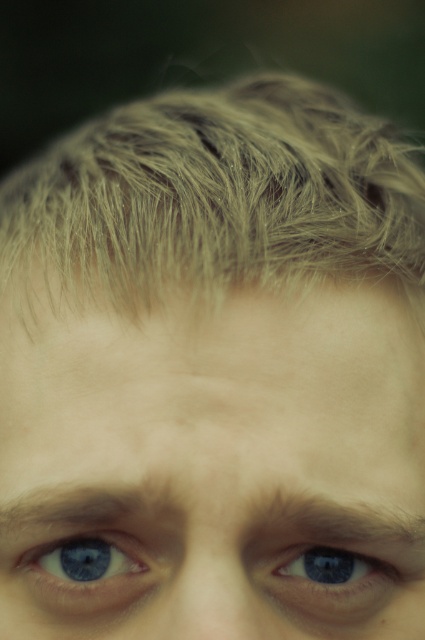
Is point (280, 280) more distant than point (280, 598)?

Yes, it is behind point (280, 598).

This screenshot has width=425, height=640. In order to click on blonde textured hair at upper center in this screenshot , I will do `click(218, 196)`.

Does point (215, 150) lie behind point (303, 561)?

Yes.

You are a GUI agent. You are given a task and a screenshot of the screen. Output one action in this format:
    pyautogui.click(x=<x>, y=<y>)
    Task: Click on the blonde textured hair at upper center
    The width and height of the screenshot is (425, 640).
    Given the screenshot: What is the action you would take?
    pyautogui.click(x=218, y=196)

Consider the image. Does blue glossy eye at center appear over blue glossy eye at lower left?

Actually, blue glossy eye at center is below blue glossy eye at lower left.

Between blue glossy eye at center and blue glossy eye at lower left, which one is positioned lower?

blue glossy eye at center

You are a GUI agent. You are given a task and a screenshot of the screen. Output one action in this format:
    pyautogui.click(x=<x>, y=<y>)
    Task: Click on the blue glossy eye at center
    The width and height of the screenshot is (425, 640).
    Given the screenshot: What is the action you would take?
    pyautogui.click(x=331, y=577)

Is point (204, 536) closer to viewer compared to point (334, 198)?

Yes, point (204, 536) is in front of point (334, 198).

You are a GUI agent. You are given a task and a screenshot of the screen. Output one action in this format:
    pyautogui.click(x=<x>, y=<y>)
    Task: Click on the blue skin at center
    The height and width of the screenshot is (640, 425).
    Given the screenshot: What is the action you would take?
    pyautogui.click(x=212, y=465)